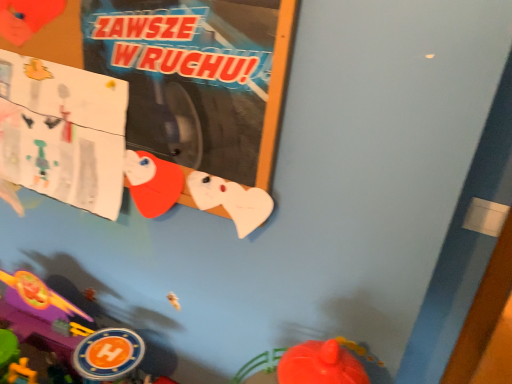
Find the location of a particular element. The height and width of the screenshot is (384, 512). smooth plastic toy at lower left is located at coordinates (67, 333).

The height and width of the screenshot is (384, 512). What do you see at coordinates (67, 333) in the screenshot? I see `smooth plastic toy at lower left` at bounding box center [67, 333].

This screenshot has width=512, height=384. I want to click on white paper at upper left, so click(x=63, y=132).

What do you see at coordinates (63, 132) in the screenshot? I see `white paper at upper left` at bounding box center [63, 132].

Measure the distance between white paper at upper left and camera.

The distance of white paper at upper left from camera is 22.30 inches.

At what (x,y) coordinates should I click in order to perform the action: click on smooth plastic toy at lower left. Please return your answer as a coordinate pair (x, y). This screenshot has width=512, height=384. Looking at the image, I should click on (67, 333).

Does smooth plastic toy at lower left appear on the right side of white paper at upper left?

No, smooth plastic toy at lower left is not to the right of white paper at upper left.

Looking at this image, which object is more forward, smooth plastic toy at lower left or white paper at upper left?

Positioned in front is smooth plastic toy at lower left.

Which point is more distant from viewer, (46, 378) or (97, 183)?

Point (46, 378)

From the image's perspective, does smooth plastic toy at lower left appear higher than white paper at upper left?

No, from the image's perspective, smooth plastic toy at lower left is not on top of white paper at upper left.

Consider the image. From a real-world perspective, is smooth plastic toy at lower left on white paper at upper left?

Actually, smooth plastic toy at lower left is physically below white paper at upper left in the real world.

Between smooth plastic toy at lower left and white paper at upper left, which one has smaller width?

With smaller width is white paper at upper left.

Is smooth plastic toy at lower left shorter than white paper at upper left?

No, smooth plastic toy at lower left is not shorter than white paper at upper left.

Can you confirm if smooth plastic toy at lower left is smaller than white paper at upper left?

No, smooth plastic toy at lower left is not smaller than white paper at upper left.

Is smooth plastic toy at lower left outside of white paper at upper left?

Indeed, smooth plastic toy at lower left is completely outside white paper at upper left.

Would you say smooth plastic toy at lower left is a long distance from white paper at upper left?

Actually, smooth plastic toy at lower left and white paper at upper left are a little close together.

Is smooth plastic toy at lower left aimed at white paper at upper left?

No.

Locate an element on the screen. poster page above the smooth plastic toy at lower left (from the image's perspective) is located at coordinates (63, 132).

Considering the relative positions of white paper at upper left and smooth plastic toy at lower left in the image provided, is white paper at upper left to the left of smooth plastic toy at lower left from the viewer's perspective?

No, white paper at upper left is not to the left of smooth plastic toy at lower left.

Relative to smooth plastic toy at lower left, is white paper at upper left in front or behind?

Visually, white paper at upper left is located behind smooth plastic toy at lower left.

Does point (38, 130) come farther from viewer compared to point (121, 366)?

Yes, it is behind point (121, 366).

From the image's perspective, which is above, white paper at upper left or smooth plastic toy at lower left?

white paper at upper left is shown above in the image.

Based on the photo, from a real-world perspective, relative to smooth plastic toy at lower left, is white paper at upper left vertically above or below?

Clearly, from a real-world perspective, white paper at upper left is above smooth plastic toy at lower left.

Can you confirm if white paper at upper left is thinner than smooth plastic toy at lower left?

Yes.

From the picture: Is white paper at upper left taller than smooth plastic toy at lower left?

In fact, white paper at upper left may be shorter than smooth plastic toy at lower left.

Considering the relative sizes of white paper at upper left and smooth plastic toy at lower left in the image provided, is white paper at upper left bigger than smooth plastic toy at lower left?

No, white paper at upper left is not bigger than smooth plastic toy at lower left.

Could smooth plastic toy at lower left be considered to be inside white paper at upper left?

No.

Is white paper at upper left far from smooth plastic toy at lower left?

That's not correct — white paper at upper left is a little close to smooth plastic toy at lower left.

Is white paper at upper left facing away from smooth plastic toy at lower left?

white paper at upper left does not have its back to smooth plastic toy at lower left.

You are a GUI agent. You are given a task and a screenshot of the screen. Output one action in this format:
    pyautogui.click(x=<x>, y=<y>)
    Task: Click on the toy on the left of white paper at upper left
    This screenshot has width=512, height=384.
    Given the screenshot: What is the action you would take?
    pyautogui.click(x=67, y=333)

Locate an element on the screen. This screenshot has width=512, height=384. toy below the white paper at upper left (from a real-world perspective) is located at coordinates coord(67,333).

The image size is (512, 384). What are the coordinates of `poster page above the smooth plastic toy at lower left (from the image's perspective)` in the screenshot? It's located at (63, 132).